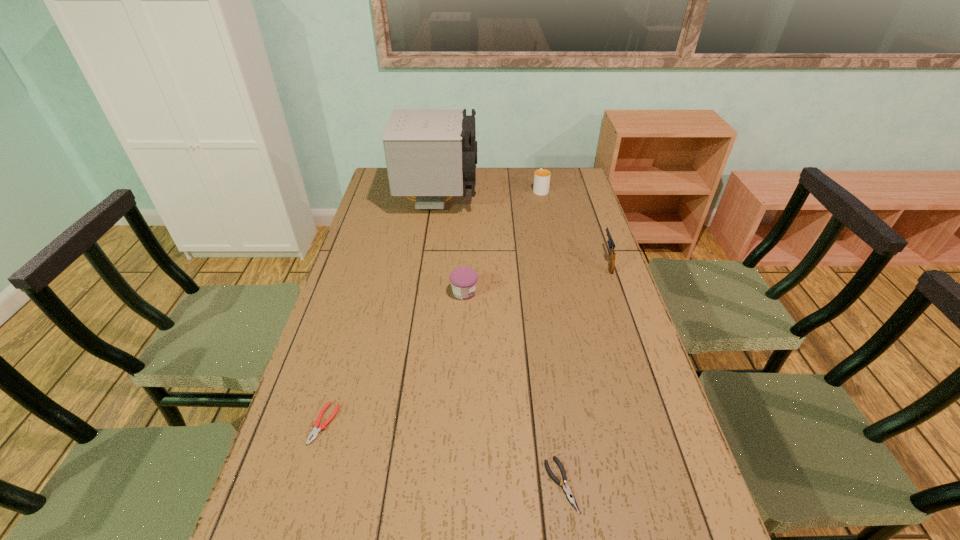
Identify the location of free space at the right edge. (605, 336).

Where is `free spot at the far right corner of the desktop`? free spot at the far right corner of the desktop is located at coordinates (561, 189).

Identify the location of free space between the cup and the tallest object. The height and width of the screenshot is (540, 960). (490, 195).

What are the coordinates of `free space that is in between the farther pliers and the third object from right to left` in the screenshot? It's located at (443, 454).

Locate an element on the screen. The width and height of the screenshot is (960, 540). vacant space that's between the nearest object and the fourth farthest object is located at coordinates (513, 388).

What are the coordinates of `vacant area that lies between the fourth farthest object and the nearer pliers` in the screenshot? It's located at (513, 388).

Find the location of a particular element. The image size is (960, 540). vacant point located between the fourth nearest object and the cup is located at coordinates (574, 225).

The height and width of the screenshot is (540, 960). In order to click on free point between the farther pliers and the second object from right to left in this screenshot , I will do `click(432, 306)`.

Where is `vacant area that lies between the gun and the nearest object`? The image size is (960, 540). vacant area that lies between the gun and the nearest object is located at coordinates (584, 373).

Find the location of a particular element. Image resolution: width=960 pixels, height=540 pixels. vacant region between the leftmost object and the rightmost object is located at coordinates (466, 342).